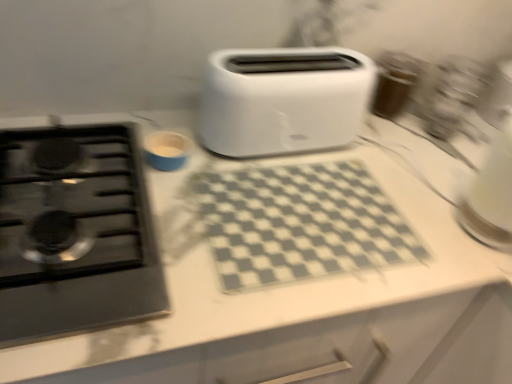
Question: Is white plastic toaster at center taller or shorter than black glass gas stove at left?

Choices:
 (A) short
 (B) tall

Answer: (B)

Question: Is white plastic toaster at center wider or thinner than black glass gas stove at left?

Choices:
 (A) wide
 (B) thin

Answer: (B)

Question: From a real-world perspective, relative to black glass gas stove at left, is white plastic toaster at center vertically above or below?

Choices:
 (A) above
 (B) below

Answer: (A)

Question: From the image's perspective, is black glass gas stove at left located above or below white plastic toaster at center?

Choices:
 (A) above
 (B) below

Answer: (B)

Question: Visually, is black glass gas stove at left positioned to the left or to the right of white plastic toaster at center?

Choices:
 (A) right
 (B) left

Answer: (B)

Question: Is point (114, 205) positioned closer to the camera than point (246, 130)?

Choices:
 (A) closer
 (B) farther

Answer: (A)

Question: Is black glass gas stove at left wider or thinner than white plastic toaster at center?

Choices:
 (A) wide
 (B) thin

Answer: (A)